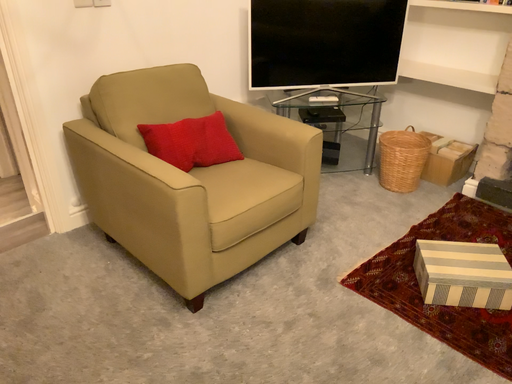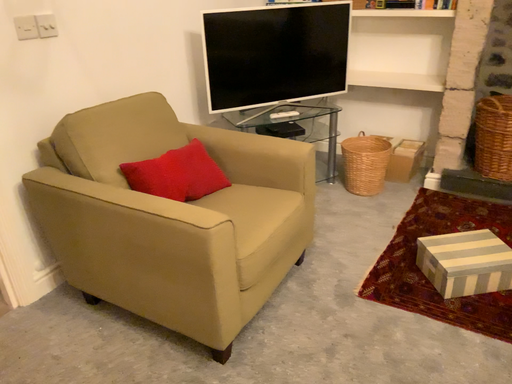
Question: Which way did the camera rotate in the video?

Choices:
 (A) rotated right
 (B) rotated left

Answer: (A)